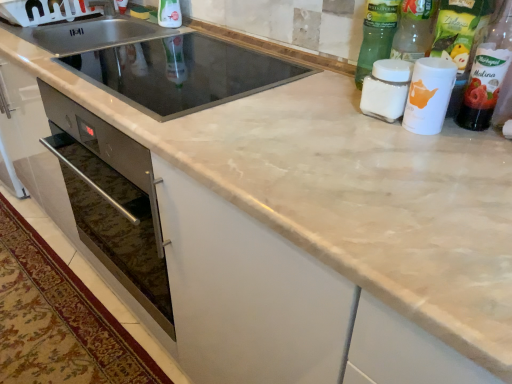
What are the coordinates of `free space in front of white matte jar at upper right, arranged as the second bottle when viewed from the left` in the screenshot? It's located at [407, 147].